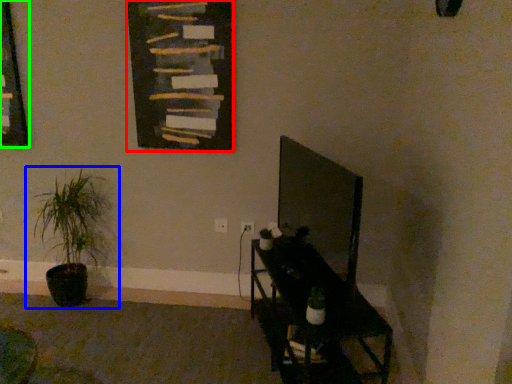
Question: Which object is the closest to the bulletin board (highlighted by a red box)? Choose among these: houseplant (highlighted by a blue box) or picture frame (highlighted by a green box).

Choices:
 (A) houseplant
 (B) picture frame

Answer: (A)